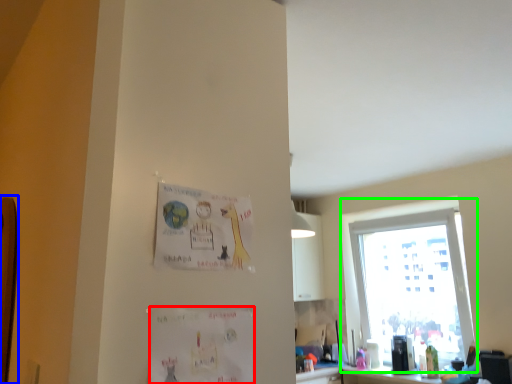
Question: Which is nearer to the postcard (highlighted by a red box)? bulletin board (highlighted by a blue box) or window (highlighted by a green box).

Choices:
 (A) bulletin board
 (B) window

Answer: (A)